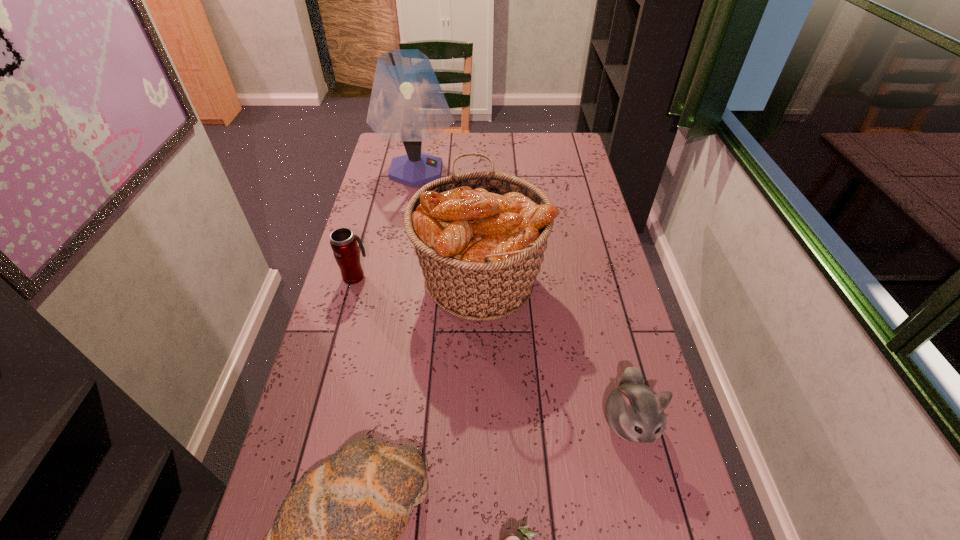
Identify the location of free spot at the far right corner of the desktop. The width and height of the screenshot is (960, 540). (555, 149).

What are the coordinates of `free point between the basket and the thermos bottle` in the screenshot? It's located at (418, 277).

Locate an element on the screen. vacant space in between the basket and the hamster is located at coordinates (554, 350).

Locate which object is the fifth closest to the second tallest object. Please provide its 2D coordinates. Your answer should be formatted as a tuple, i.e. [(x, y)], where the tuple contains the x and y coordinates of a point satisfying the conditions above.

[(511, 539)]

At what (x,y) coordinates should I click in order to perform the action: click on object that is the third nearest to the bread. Please return your answer as a coordinate pair (x, y). This screenshot has height=540, width=960. Looking at the image, I should click on (634, 412).

Where is `free location that satisfies the following two spatial constraints: 1. on the base of the tallest object; 2. on the back side of the second tallest object`? The height and width of the screenshot is (540, 960). free location that satisfies the following two spatial constraints: 1. on the base of the tallest object; 2. on the back side of the second tallest object is located at coordinates (396, 278).

This screenshot has height=540, width=960. Find the location of `vacant space that satisfies the following two spatial constraints: 1. on the base of the lampshade; 2. on the back side of the basket`. vacant space that satisfies the following two spatial constraints: 1. on the base of the lampshade; 2. on the back side of the basket is located at coordinates (396, 278).

Find the location of a particular element. Image resolution: width=960 pixels, height=540 pixels. vacant position in the image that satisfies the following two spatial constraints: 1. on the base of the tallest object; 2. on the back side of the second tallest object is located at coordinates (396, 278).